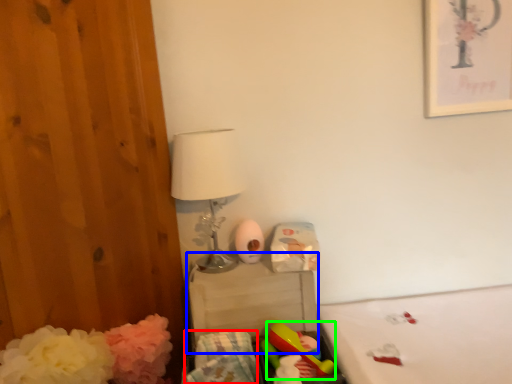
Question: Which is farther away from material (highlighted by a red box)? changing table (highlighted by a blue box) or toy (highlighted by a green box)?

Choices:
 (A) changing table
 (B) toy

Answer: (A)